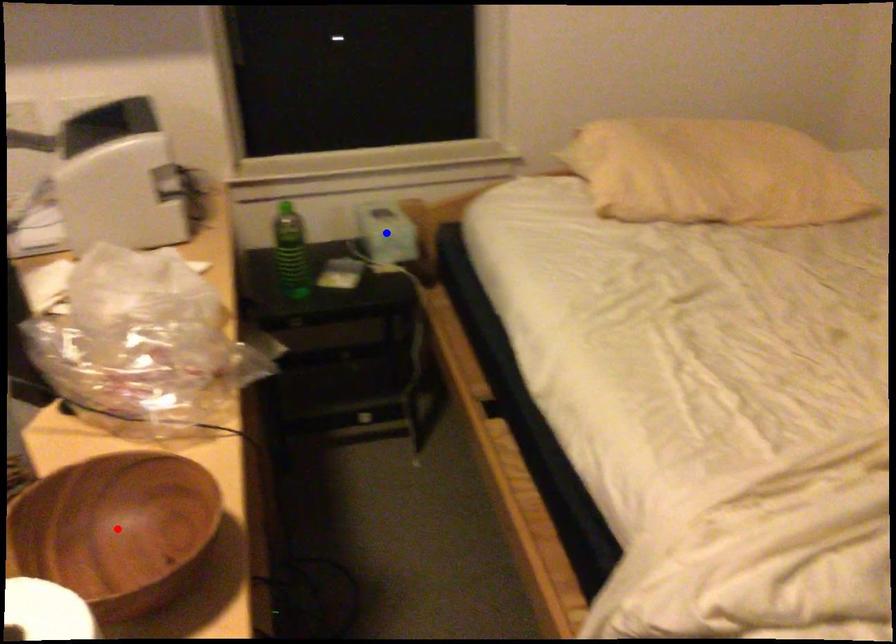
Question: In the image, two points are highlighted. Which point is nearer to the camera? Reply with the corresponding letter.

Choices:
 (A) blue point
 (B) red point

Answer: (B)